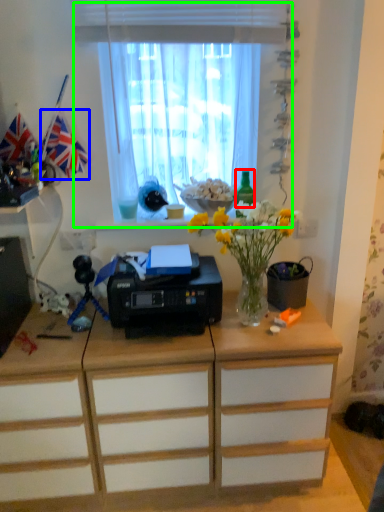
Question: Based on their relative distances, which object is nearer to bottle (highlighted by a red box)? Choose from flag (highlighted by a blue box) and window (highlighted by a green box).

Choices:
 (A) flag
 (B) window

Answer: (B)